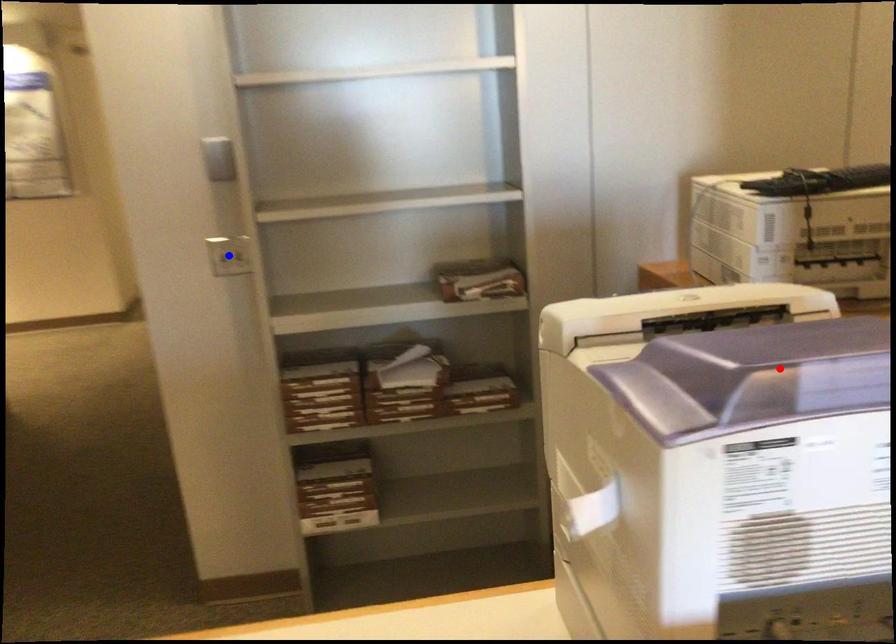
Question: Two points are marked on the image. Which point is closer to the camera?

Choices:
 (A) Blue point is closer.
 (B) Red point is closer.

Answer: (B)